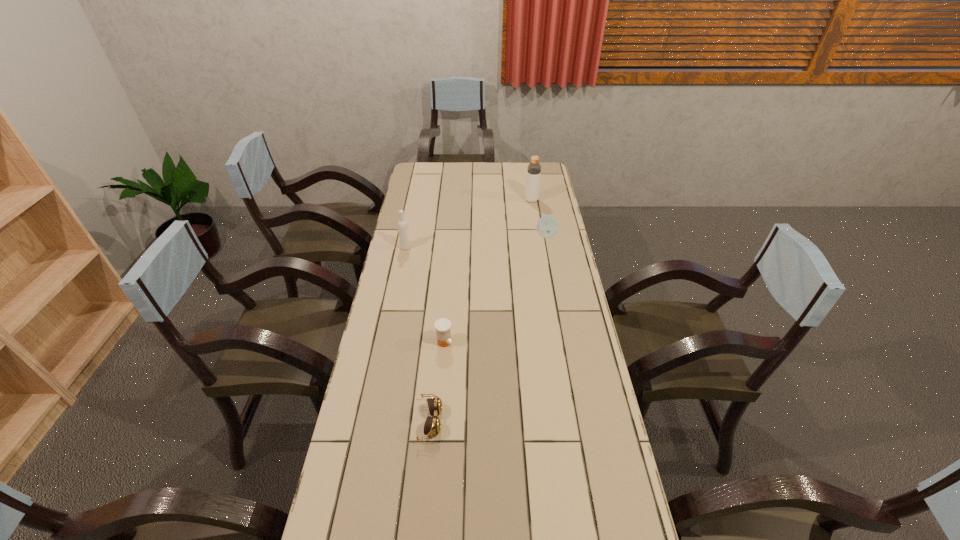
The image size is (960, 540). I want to click on vacant point located on the front of the fourth nearest object, so click(x=561, y=309).

Identify the location of free region located on the label of the fourth farthest object. (440, 399).

Identify the location of vacant space located 0.210m through the lenses of the shortest object. (516, 421).

I want to click on object that is at the left edge, so click(x=403, y=229).

Identify the location of bottle present at the right edge. (534, 168).

In order to click on apple that is at the right edge in this screenshot , I will do `click(547, 227)`.

The image size is (960, 540). In order to click on free space at the far edge in this screenshot , I will do `click(484, 166)`.

This screenshot has width=960, height=540. In the image, there is a desktop. In order to click on blank space at the left edge in this screenshot , I will do `click(347, 455)`.

Find the location of `vacant space at the right edge of the desktop`. vacant space at the right edge of the desktop is located at coordinates (543, 294).

You are a GUI agent. You are given a task and a screenshot of the screen. Output one action in this format:
    pyautogui.click(x=<x>, y=<y>)
    Task: Click on the vacant space at the far left corner of the desktop
    
    Given the screenshot: What is the action you would take?
    pyautogui.click(x=409, y=177)